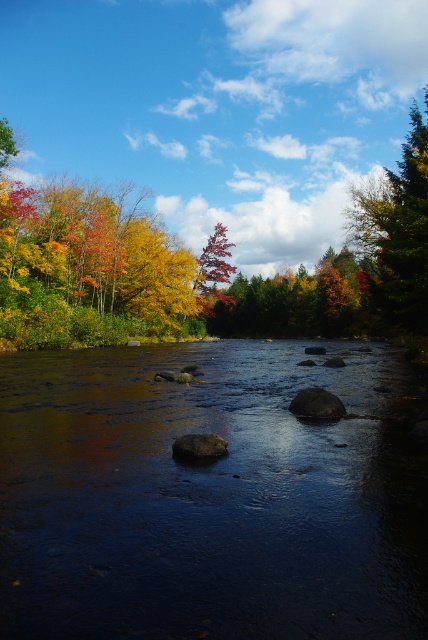
Which of these two, autumn foliage at center or shiny red tree at center, stands shorter?

shiny red tree at center is shorter.

Which is in front, point (44, 212) or point (219, 221)?

Point (44, 212) is in front.

You are a GUI agent. You are given a task and a screenshot of the screen. Output one action in this format:
    pyautogui.click(x=<x>, y=<y>)
    Task: Click on the autumn foliage at center
    The height and width of the screenshot is (640, 428).
    Given the screenshot: What is the action you would take?
    pyautogui.click(x=199, y=268)

Which is below, dark reflective water at center or green matte tree at upper right?

Positioned lower is dark reflective water at center.

Who is higher up, dark reflective water at center or green matte tree at upper right?

green matte tree at upper right is higher up.

Is point (312, 483) positioned after point (369, 316)?

No, (312, 483) is closer to viewer.

At what (x,y) coordinates should I click in order to perform the action: click on dark reflective water at center. Please return your answer as a coordinate pair (x, y). Image resolution: width=428 pixels, height=640 pixels. Looking at the image, I should click on (208, 499).

Is autumn foliage at center to the right of green matte tree at upper right from the viewer's perspective?

In fact, autumn foliage at center is to the left of green matte tree at upper right.

Is autumn foliage at center positioned behind green matte tree at upper right?

No, autumn foliage at center is in front of green matte tree at upper right.

Where is `autumn foliage at center`? Image resolution: width=428 pixels, height=640 pixels. autumn foliage at center is located at coordinates (199, 268).